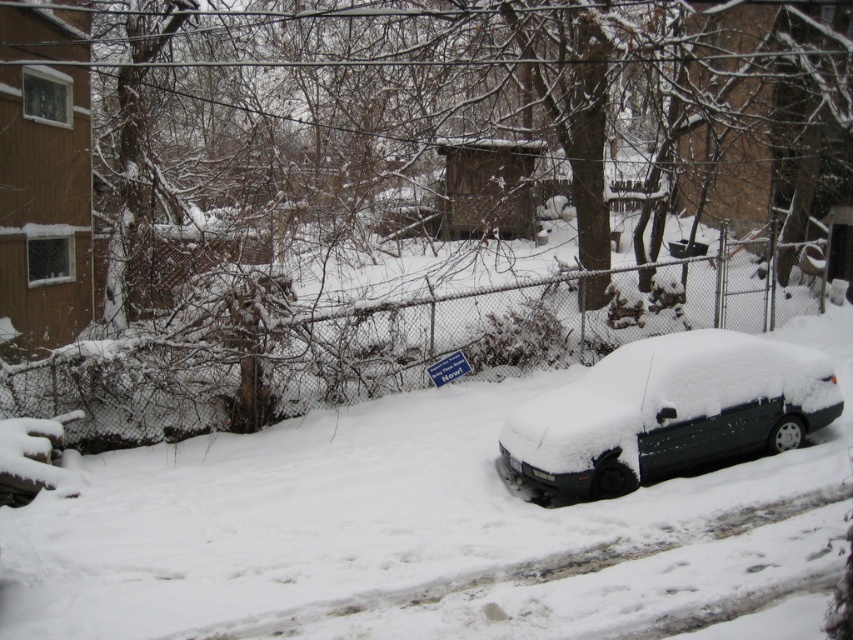
You are standing at the point with coordinates point (392, 348) in the snowy urban scene. What object are you standing on?

The point (392, 348) corresponds to the chainlink fence at center, so you are standing on the chainlink fence at center.

You are standing in the snowy urban scene and want to take a photo of both point [720,259] and point [786,413]. Which point should you focus on first to ensure both are in clear view?

You should focus on point [720,259] first because it is closer to you than point [786,413], ensuring both points are within the camera focus range.